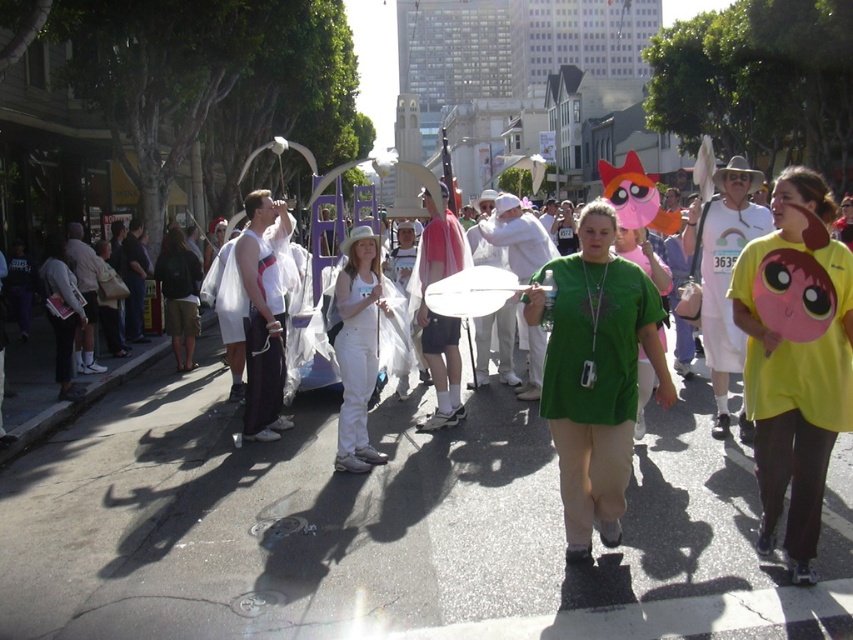
Question: Is green fabric balloon at center further to the viewer compared to white matte pants at center?

Choices:
 (A) yes
 (B) no

Answer: (A)

Question: Which point appears closest to the camera in this image?

Choices:
 (A) (357, 275)
 (B) (61, 522)

Answer: (B)

Question: Does green fabric balloon at center have a smaller size compared to white matte pants at center?

Choices:
 (A) yes
 (B) no

Answer: (A)

Question: Which point appears farthest from the camera in this image?

Choices:
 (A) (363, 454)
 (B) (556, 561)

Answer: (A)

Question: From the image, what is the correct spatial relationship of green fabric balloon at center in relation to white matte pants at center?

Choices:
 (A) above
 (B) below

Answer: (B)

Question: Which of the following is the closest to the observer?

Choices:
 (A) click(x=706, y=547)
 (B) click(x=343, y=301)

Answer: (A)